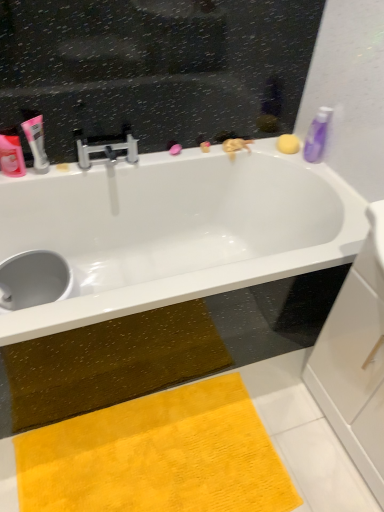
What do you see at coordinates (107, 151) in the screenshot?
I see `silver metallic faucet at upper center` at bounding box center [107, 151].

Describe the element at coordinates (288, 144) in the screenshot. This screenshot has width=384, height=512. I see `yellow sponge at upper right` at that location.

Measure the distance between point (321, 112) and camera.

5.29 feet.

The image size is (384, 512). I want to click on pink matte tube at upper left, which appears as the 2th toiletry when viewed from the right, so click(x=36, y=142).

Is yellow sponge at upper right facing away from yellow plush doormat at lower center?

yellow sponge at upper right is not turned away from yellow plush doormat at lower center.

In the scene shown: Is yellow sponge at upper right at the left side of yellow plush doormat at lower center?

In fact, yellow sponge at upper right is to the right of yellow plush doormat at lower center.

You are a GUI agent. You are given a task and a screenshot of the screen. Output one action in this format:
    pyautogui.click(x=<x>, y=<y>)
    Task: Click on the doormat that is under the yellow sponge at upper right (from a real-world perspective)
    The height and width of the screenshot is (512, 384).
    Given the screenshot: What is the action you would take?
    pyautogui.click(x=157, y=457)

From the image's perspective, is yellow sponge at upper right located beneath yellow plush doormat at lower center?

No, from the image's perspective, yellow sponge at upper right is not beneath yellow plush doormat at lower center.

From the image's perspective, starting from the purple glossy bottle at upper right, the 1th toiletry when ordered from right to left, which toiletry is the 2nd one below? Please provide its 2D coordinates.

[(11, 153)]

In the scene shown: Is matte pink tube at left, which ranks as the third toiletry in right-to-left order, smaller than purple glossy bottle at upper right, the 1th toiletry when ordered from right to left?

Correct, matte pink tube at left, which ranks as the third toiletry in right-to-left order, occupies less space than purple glossy bottle at upper right, the 1th toiletry when ordered from right to left.

How many degrees apart are the facing directions of matte pink tube at left, which is the 1th toiletry from left to right, and purple glossy bottle at upper right, the 1th toiletry when ordered from right to left?

They differ by 90 degrees in their facing directions.

Which object is closer to the camera, yellow sponge at upper right or pink matte tube at upper left, which appears as the 2th toiletry when viewed from the right?

pink matte tube at upper left, which appears as the 2th toiletry when viewed from the right, is in front.

Does yellow sponge at upper right appear on the right side of pink matte tube at upper left, marked as the 2th toiletry in a left-to-right arrangement?

Indeed, yellow sponge at upper right is positioned on the right side of pink matte tube at upper left, marked as the 2th toiletry in a left-to-right arrangement.

Are yellow sponge at upper right and pink matte tube at upper left, which appears as the 2th toiletry when viewed from the right, beside each other?

No, yellow sponge at upper right is not in contact with pink matte tube at upper left, which appears as the 2th toiletry when viewed from the right.

From the picture: Could you measure the distance between purple glossy bottle at upper right, the 1th toiletry when ordered from right to left, and matte pink tube at left, which is the 1th toiletry from left to right?

They are 1.11 meters apart.

Which of these two, purple glossy bottle at upper right, the third toiletry viewed from the left, or matte pink tube at left, which is the 1th toiletry from left to right, stands shorter?

matte pink tube at left, which is the 1th toiletry from left to right.

Does purple glossy bottle at upper right, the third toiletry viewed from the left, touch matte pink tube at left, which is the 1th toiletry from left to right?

No, purple glossy bottle at upper right, the third toiletry viewed from the left, is not with matte pink tube at left, which is the 1th toiletry from left to right.

From a real-world perspective, who is located higher, yellow plush doormat at lower center or white glossy bathtub at upper center?

white glossy bathtub at upper center is physically above.

Is yellow plush doormat at lower center turned away from white glossy bathtub at upper center?

Yes, yellow plush doormat at lower center is facing away from white glossy bathtub at upper center.

Is white glossy bathtub at upper center a part of yellow plush doormat at lower center?

No, yellow plush doormat at lower center does not contain white glossy bathtub at upper center.

Image resolution: width=384 pixels, height=512 pixels. I want to click on toiletry on the right of white glossy bathtub at upper center, so click(317, 135).

Who is bigger, white glossy bathtub at upper center or purple glossy bottle at upper right, the 1th toiletry when ordered from right to left?

white glossy bathtub at upper center is bigger.

Does white glossy bathtub at upper center turn towards purple glossy bottle at upper right, the 1th toiletry when ordered from right to left?

No, white glossy bathtub at upper center is not facing towards purple glossy bottle at upper right, the 1th toiletry when ordered from right to left.

Is white glossy bathtub at upper center directly adjacent to purple glossy bottle at upper right, the 1th toiletry when ordered from right to left?

No, white glossy bathtub at upper center is not touching purple glossy bottle at upper right, the 1th toiletry when ordered from right to left.

Which is behind, point (317, 154) or point (328, 247)?

Point (317, 154)

Is white glossy bathtub at upper center completely or partially inside purple glossy bottle at upper right, the 1th toiletry when ordered from right to left?

No, purple glossy bottle at upper right, the 1th toiletry when ordered from right to left, does not contain white glossy bathtub at upper center.

Does purple glossy bottle at upper right, the third toiletry viewed from the left, touch white glossy bathtub at upper center?

No, purple glossy bottle at upper right, the third toiletry viewed from the left, is not next to white glossy bathtub at upper center.

Is purple glossy bottle at upper right, the 1th toiletry when ordered from right to left, turned away from white glossy bathtub at upper center?

No, purple glossy bottle at upper right, the 1th toiletry when ordered from right to left,'s orientation is not away from white glossy bathtub at upper center.

You are a GUI agent. You are given a task and a screenshot of the screen. Output one action in this format:
    pyautogui.click(x=<x>, y=<y>)
    Task: Click on the soap above the yellow plush doormat at lower center (from a real-world perspective)
    
    Given the screenshot: What is the action you would take?
    pyautogui.click(x=288, y=144)

From the image's perspective, count 2nd toiletrys downward from the purple glossy bottle at upper right, the 1th toiletry when ordered from right to left, and point to it. Please provide its 2D coordinates.

[(11, 153)]

When comparing their distances from white glossy bathtub at upper center, does purple glossy bottle at upper right, the 1th toiletry when ordered from right to left, or yellow sponge at upper right seem closer?

Based on the image, purple glossy bottle at upper right, the 1th toiletry when ordered from right to left, appears to be nearer to white glossy bathtub at upper center.

Considering their positions, is white glossy bathtub at upper center positioned closer to purple glossy bottle at upper right, the third toiletry viewed from the left, than matte pink tube at left, which ranks as the third toiletry in right-to-left order?

Based on the image, white glossy bathtub at upper center appears to be nearer to purple glossy bottle at upper right, the third toiletry viewed from the left.

Which object lies nearer to the anchor point pink matte tube at upper left, marked as the 2th toiletry in a left-to-right arrangement, matte pink tube at left, which ranks as the third toiletry in right-to-left order, or silver metallic faucet at upper center?

The object closer to pink matte tube at upper left, marked as the 2th toiletry in a left-to-right arrangement, is matte pink tube at left, which ranks as the third toiletry in right-to-left order.

Estimate the real-world distances between objects in this image. Which object is closer to yellow sponge at upper right, yellow plush doormat at lower center or matte pink tube at left, which ranks as the third toiletry in right-to-left order?

matte pink tube at left, which ranks as the third toiletry in right-to-left order, is positioned closer to the anchor yellow sponge at upper right.

In the scene shown: From the image, which object appears to be farther from silver metallic faucet at upper center, white glossy bathtub at upper center or matte pink tube at left, which is the 1th toiletry from left to right?

Based on the image, white glossy bathtub at upper center appears to be further to silver metallic faucet at upper center.

Considering their positions, is pink matte tube at upper left, which appears as the 2th toiletry when viewed from the right, positioned further to yellow plush doormat at lower center than silver metallic faucet at upper center?

Among the two, pink matte tube at upper left, which appears as the 2th toiletry when viewed from the right, is located further to yellow plush doormat at lower center.

Based on their spatial positions, is yellow plush doormat at lower center or matte pink tube at left, which ranks as the third toiletry in right-to-left order, further from purple glossy bottle at upper right, the third toiletry viewed from the left?

yellow plush doormat at lower center lies further to purple glossy bottle at upper right, the third toiletry viewed from the left, than the other object.

Considering their positions, is yellow sponge at upper right positioned closer to white glossy bathtub at upper center than matte pink tube at left, which is the 1th toiletry from left to right?

Among the two, yellow sponge at upper right is located nearer to white glossy bathtub at upper center.

Where is `bathtub between yellow sponge at upper right and yellow plush doormat at lower center in the up-down direction`? The image size is (384, 512). bathtub between yellow sponge at upper right and yellow plush doormat at lower center in the up-down direction is located at coordinates (175, 230).

Where is `soap between pink matte tube at upper left, which appears as the 2th toiletry when viewed from the right, and purple glossy bottle at upper right, the third toiletry viewed from the left, in the horizontal direction`? The image size is (384, 512). soap between pink matte tube at upper left, which appears as the 2th toiletry when viewed from the right, and purple glossy bottle at upper right, the third toiletry viewed from the left, in the horizontal direction is located at coordinates (288, 144).

This screenshot has width=384, height=512. I want to click on bathtub between pink matte tube at upper left, which appears as the 2th toiletry when viewed from the right, and yellow sponge at upper right, in the horizontal direction, so click(x=175, y=230).

Where is `bathtub that lies between pink matte tube at upper left, which appears as the 2th toiletry when viewed from the right, and yellow plush doormat at lower center from top to bottom`? The width and height of the screenshot is (384, 512). bathtub that lies between pink matte tube at upper left, which appears as the 2th toiletry when viewed from the right, and yellow plush doormat at lower center from top to bottom is located at coordinates (175, 230).